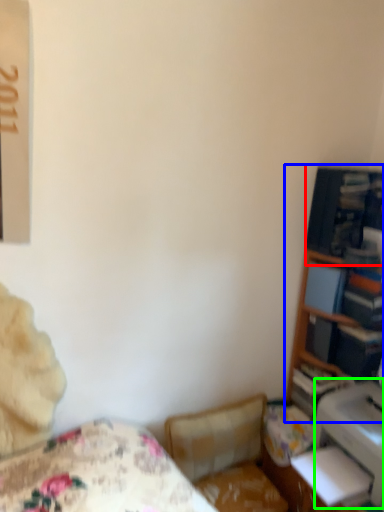
Question: Considering the real-world distances, which object is farthest from shelf (highlighted by a red box)? bookshelf (highlighted by a blue box) or printer (highlighted by a green box)?

Choices:
 (A) bookshelf
 (B) printer

Answer: (B)